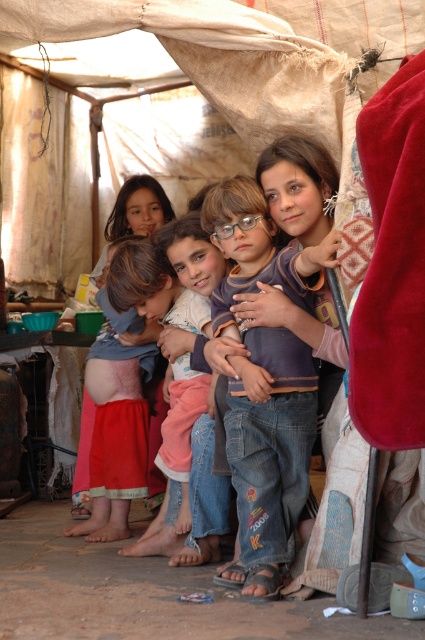
You are a photographer trying to capture a photo of the denim jeans at center and the red cotton dress at lower left. To ensure both are in the frame, should you adjust your camera to the left or right side?

The denim jeans at center is positioned on the right side of red cotton dress at lower left, so you should adjust your camera to the left to include both objects in the frame.